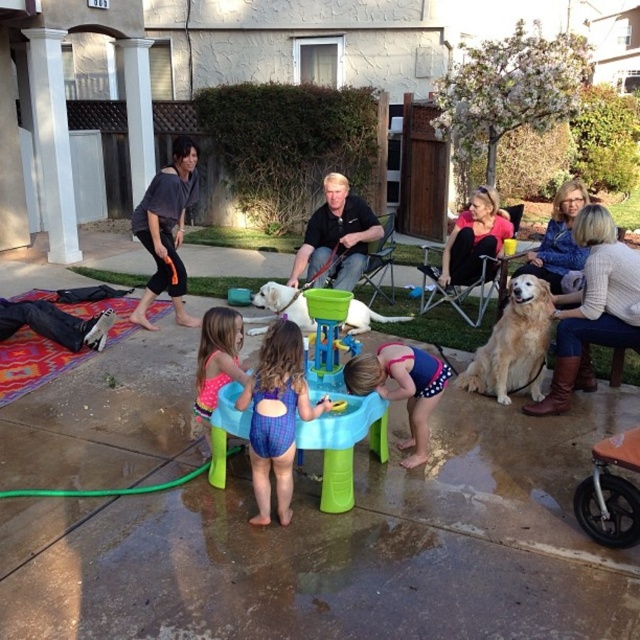
What is located at the coordinates point [166,230]?

The gray cotton shirt at upper center is located at point [166,230].

You are standing in the backyard and see the gray cotton shirt at upper center. If you want to reach it without moving your feet, can you do it?

The gray cotton shirt at upper center is 5.18 meters from the viewer, so you cannot reach it without moving your feet.

Looking at this image, you are a parent supervising the children playing at the water table. You need to hand out sunscreen to the child wearing the gray cotton shirt at upper center and the child in the pink polka dot swimsuit at center. Which child will require a larger sunscreen bottle?

The gray cotton shirt at upper center is bigger than the pink polka dot swimsuit at center, so the child wearing the gray cotton shirt at upper center will need a larger sunscreen bottle.